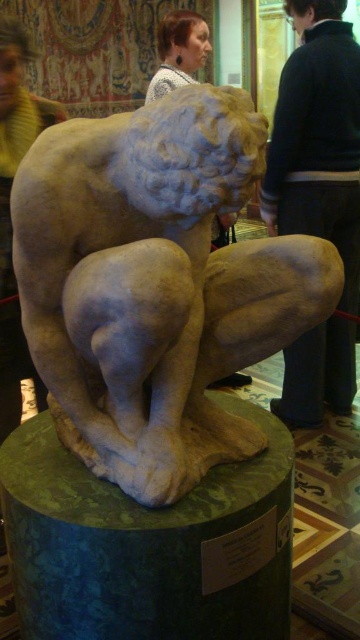
You are an art student who needs to sketch the scene. You notice the white marble statue at center and the dark blue sweater at upper center. Which object is positioned higher up in the image?

The dark blue sweater at upper center is positioned higher up in the image than the white marble statue at center.

You are an art student who wants to sketch the sculpture. You notice the green marble pedestal at center and the dark blue sweater at upper center. Which object is positioned to the right side of the other?

The dark blue sweater at upper center is positioned to the right of the green marble pedestal at center according to the description.